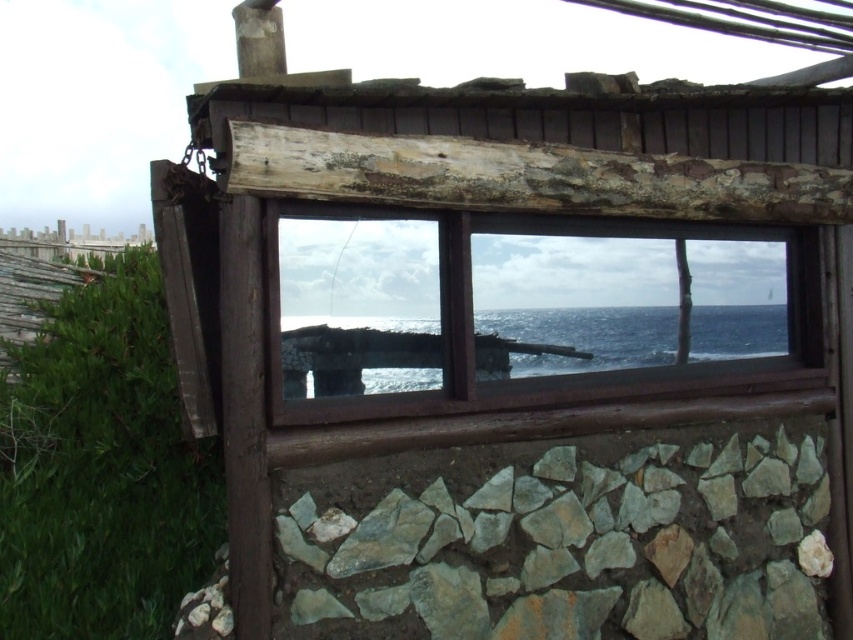
Can you confirm if brown wooden window frame at center is bigger than blue water at center?

Correct, brown wooden window frame at center is larger in size than blue water at center.

Is the position of brown wooden window frame at center more distant than that of blue water at center?

That is False.

What do you see at coordinates (518, 301) in the screenshot?
I see `brown wooden window frame at center` at bounding box center [518, 301].

Locate an element on the screen. This screenshot has height=640, width=853. brown wooden window frame at center is located at coordinates (518, 301).

Does gray rough stone at lower center appear over blue water at center?

Incorrect, gray rough stone at lower center is not positioned above blue water at center.

Measure the distance from gray rough stone at lower center to blue water at center.

gray rough stone at lower center is 25.60 inches from blue water at center.

Does point (599, 573) lie behind point (299, 339)?

Yes, point (599, 573) is behind point (299, 339).

You are a GUI agent. You are given a task and a screenshot of the screen. Output one action in this format:
    pyautogui.click(x=<x>, y=<y>)
    Task: Click on the gray rough stone at lower center
    
    Given the screenshot: What is the action you would take?
    pyautogui.click(x=560, y=538)

Who is more forward, (x=532, y=612) or (x=717, y=230)?

Point (x=532, y=612)

Can you confirm if gray rough stone at lower center is positioned below brown wooden window frame at center?

Yes.

Locate an element on the screen. Image resolution: width=853 pixels, height=640 pixels. gray rough stone at lower center is located at coordinates (560, 538).